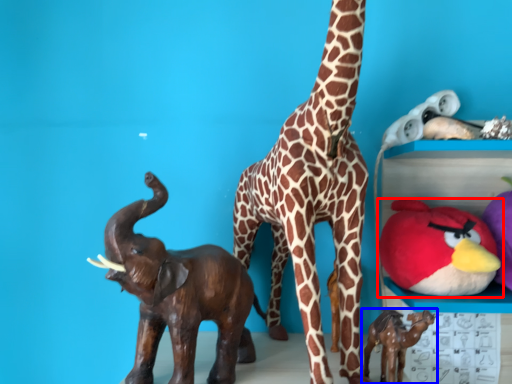
Question: Which object appears farthest to the camera in this image, toy (highlighted by a red box) or toy (highlighted by a blue box)?

Choices:
 (A) toy
 (B) toy

Answer: (A)